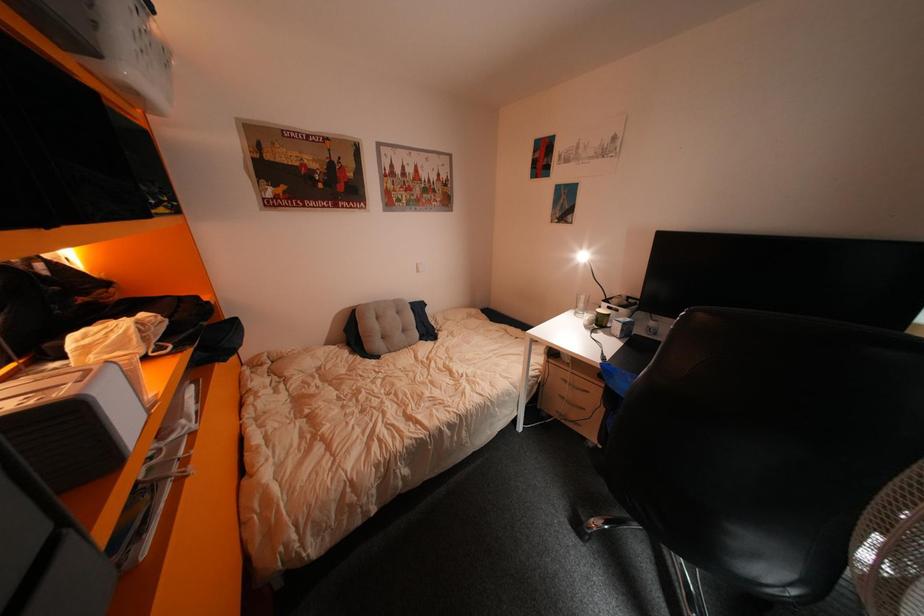
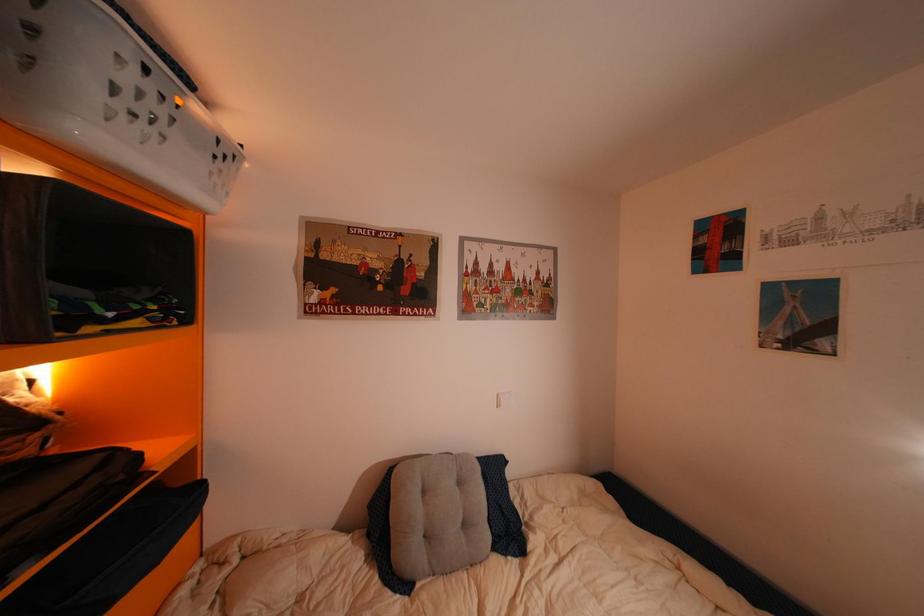
The first image is from the beginning of the video and the second image is from the end. How did the camera likely rotate when shooting the video?

The camera's rotation is toward left-up.